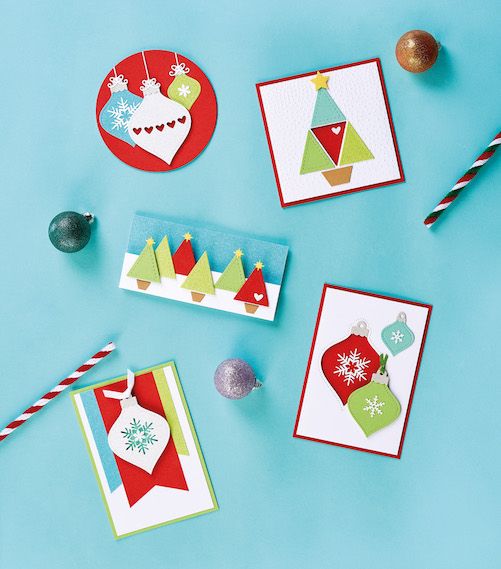
You are a GUI agent. You are given a task and a screenshot of the screen. Output one action in this format:
    pyautogui.click(x=<x>, y=<y>)
    Task: Click on the ornament
    Image resolution: width=501 pixels, height=569 pixels.
    Given the screenshot: What is the action you would take?
    pyautogui.click(x=87, y=215)